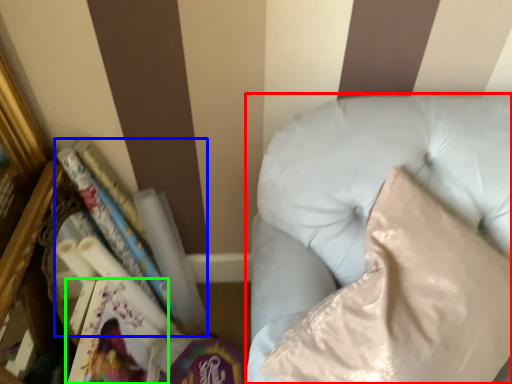
Question: Based on their relative distances, which object is farther from furniture (highlighted by a red box)? Choose from book (highlighted by a blue box) and paperback book (highlighted by a green box).

Choices:
 (A) book
 (B) paperback book

Answer: (B)